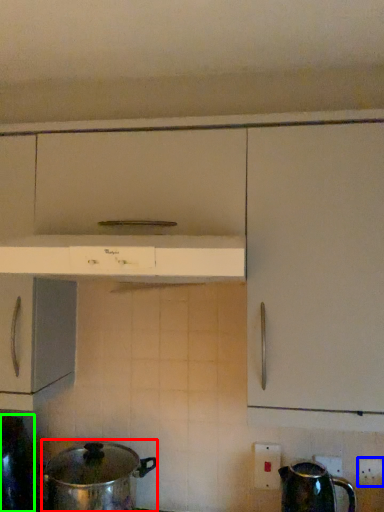
Question: Which is farther away from crock pot (highlighted by a red box)? electric outlet (highlighted by a blue box) or kitchen appliance (highlighted by a green box)?

Choices:
 (A) electric outlet
 (B) kitchen appliance

Answer: (A)